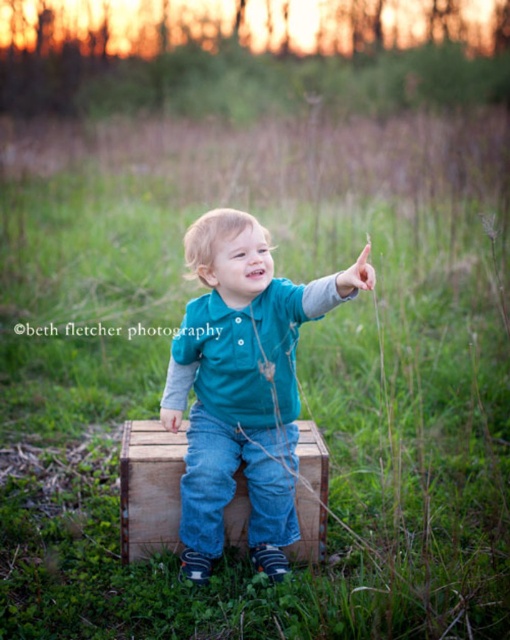
Which of these two, teal fabric shirt at center or wooden crate at center, stands shorter?

With less height is wooden crate at center.

The height and width of the screenshot is (640, 510). I want to click on teal fabric shirt at center, so click(x=242, y=385).